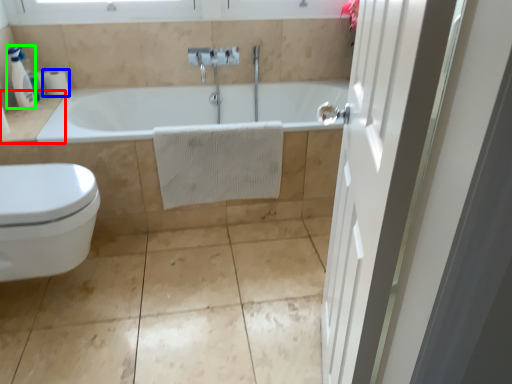
Question: Based on their relative distances, which object is nearer to counter top (highlighted by a red box)? Choose from toilet paper (highlighted by a blue box) and soap dispenser (highlighted by a green box).

Choices:
 (A) toilet paper
 (B) soap dispenser

Answer: (B)